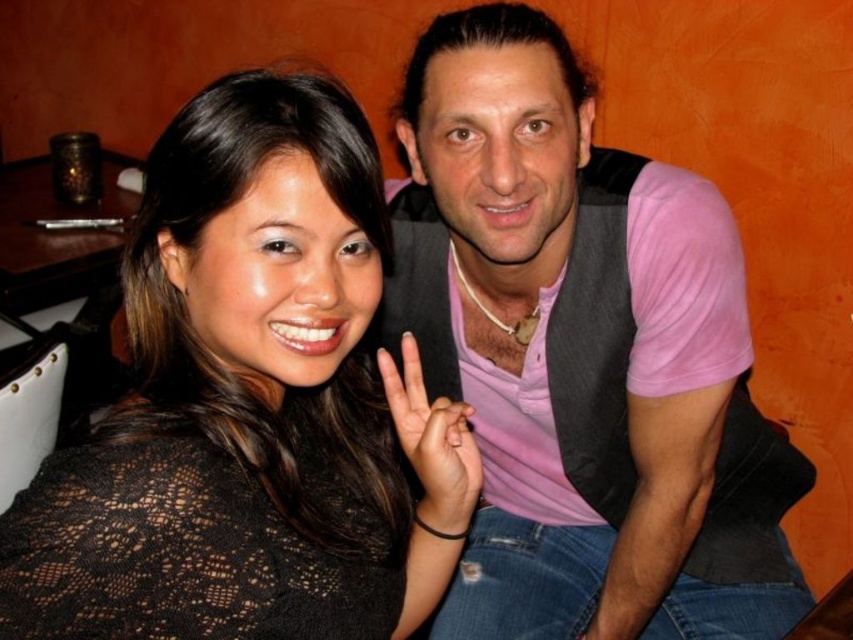
You are a photographer trying to capture a closeup of the pink fabric vest at upper right and the black lace hand at center. Which object is positioned to the right side of the other?

The pink fabric vest at upper right is to the right of the black lace hand at center.

You are standing in a room and see the pink fabric vest at upper right. If you want to reach out and touch it, will your hand be able to reach it without moving closer?

The pink fabric vest at upper right is 35.51 inches away from the viewer, so yes, your hand can reach it without moving closer.